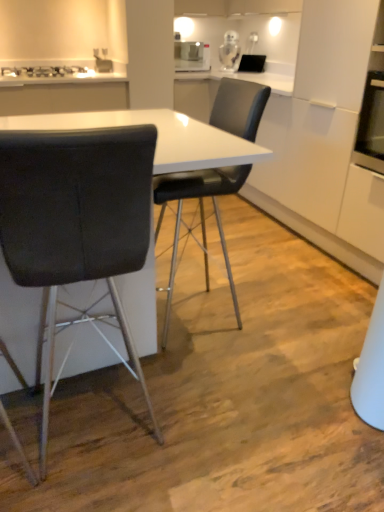
Question: Does black leather chair at center, which is the 1th chair from right to left, turn towards metallic silver gas stove at upper left?

Choices:
 (A) yes
 (B) no

Answer: (B)

Question: Is black leather chair at center, which ranks as the 2th chair in left-to-right order, thinner than metallic silver gas stove at upper left?

Choices:
 (A) no
 (B) yes

Answer: (A)

Question: From a real-world perspective, does black leather chair at center, which ranks as the 2th chair in left-to-right order, stand above metallic silver gas stove at upper left?

Choices:
 (A) yes
 (B) no

Answer: (B)

Question: Is black leather chair at center, which ranks as the 2th chair in left-to-right order, to the right of metallic silver gas stove at upper left from the viewer's perspective?

Choices:
 (A) no
 (B) yes

Answer: (B)

Question: From the image's perspective, is black leather chair at center, which ranks as the 2th chair in left-to-right order, beneath metallic silver gas stove at upper left?

Choices:
 (A) yes
 (B) no

Answer: (A)

Question: Does point (137, 109) appear closer or farther from the camera than point (223, 60)?

Choices:
 (A) closer
 (B) farther

Answer: (A)

Question: Which is correct: white glossy table at center is inside clear glass jar at upper center, which is counted as the 1th appliance, starting from the right, or outside of it?

Choices:
 (A) inside
 (B) outside

Answer: (B)

Question: In terms of width, does white glossy table at center look wider or thinner when compared to clear glass jar at upper center, placed as the 2th appliance when sorted from left to right?

Choices:
 (A) wide
 (B) thin

Answer: (A)

Question: Is white glossy table at center in front of or behind clear glass jar at upper center, which is counted as the 1th appliance, starting from the right, in the image?

Choices:
 (A) behind
 (B) front

Answer: (B)

Question: Looking at the image, does clear glass jar at upper center, which is counted as the 1th appliance, starting from the right, seem bigger or smaller compared to black leather chair at left, which is counted as the first chair, starting from the left?

Choices:
 (A) small
 (B) big

Answer: (A)

Question: Is clear glass jar at upper center, placed as the 2th appliance when sorted from left to right, inside or outside of black leather chair at left, which is counted as the first chair, starting from the left?

Choices:
 (A) outside
 (B) inside

Answer: (A)

Question: From a real-world perspective, is clear glass jar at upper center, placed as the 2th appliance when sorted from left to right, above or below black leather chair at left, which is counted as the first chair, starting from the left?

Choices:
 (A) above
 (B) below

Answer: (A)

Question: Is clear glass jar at upper center, placed as the 2th appliance when sorted from left to right, to the left or to the right of black leather chair at left, which is the second chair in right-to-left order, in the image?

Choices:
 (A) right
 (B) left

Answer: (A)

Question: Considering their positions, is white glossy toaster at upper center, marked as the 2th appliance in a right-to-left arrangement, located in front of or behind clear glass jar at upper center, which is counted as the 1th appliance, starting from the right?

Choices:
 (A) front
 (B) behind

Answer: (A)

Question: Based on their positions, is white glossy toaster at upper center, marked as the first appliance in a left-to-right arrangement, located to the left or right of clear glass jar at upper center, placed as the 2th appliance when sorted from left to right?

Choices:
 (A) left
 (B) right

Answer: (A)